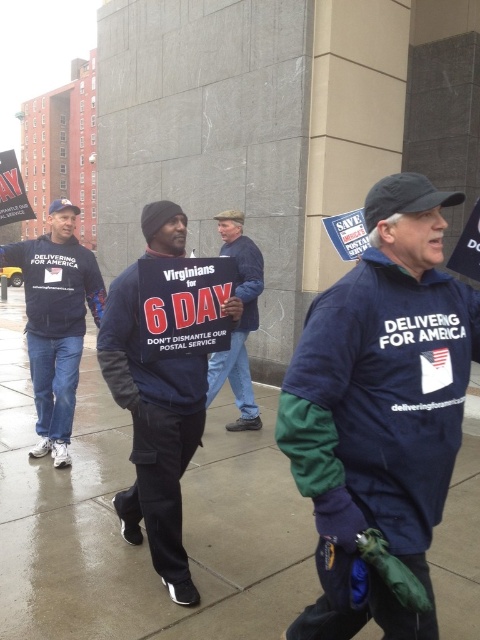
Question: Does wet concrete sidewalk at center have a larger size compared to dark blue sweatshirt at center?

Choices:
 (A) no
 (B) yes

Answer: (A)

Question: Which is farther from the dark blue sweatshirt at center?

Choices:
 (A) denim jacket at center
 (B) wet concrete sidewalk at center

Answer: (B)

Question: Is wet concrete sidewalk at center behind navy blue jacket at center?

Choices:
 (A) yes
 (B) no

Answer: (A)

Question: Among these objects, which one is nearest to the camera?

Choices:
 (A) wet concrete sidewalk at center
 (B) dark blue sweatshirt at center
 (C) matte black jacket at left

Answer: (B)

Question: Can you confirm if dark blue sweatshirt at center is positioned above matte black jacket at left?

Choices:
 (A) yes
 (B) no

Answer: (B)

Question: Which point is closer to the camera?

Choices:
 (A) wet concrete sidewalk at center
 (B) denim jacket at center

Answer: (B)